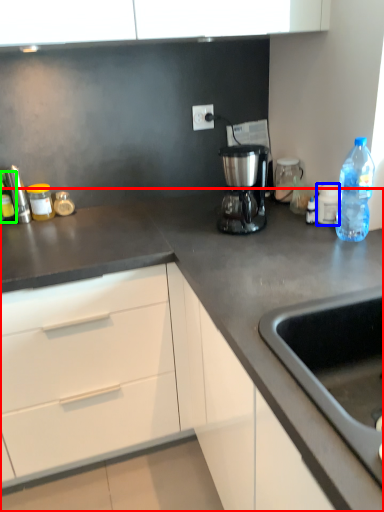
Question: Which object is the farthest from countertop (highlighted by a red box)? Choose among these: appliance (highlighted by a blue box) or bottle (highlighted by a green box).

Choices:
 (A) appliance
 (B) bottle

Answer: (B)